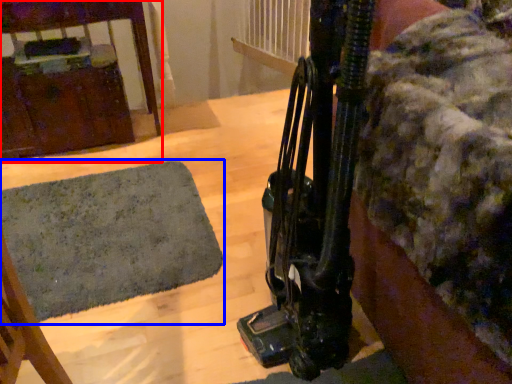
Question: Which object appears farthest to the camera in this image, furniture (highlighted by a red box) or mat (highlighted by a blue box)?

Choices:
 (A) furniture
 (B) mat

Answer: (A)